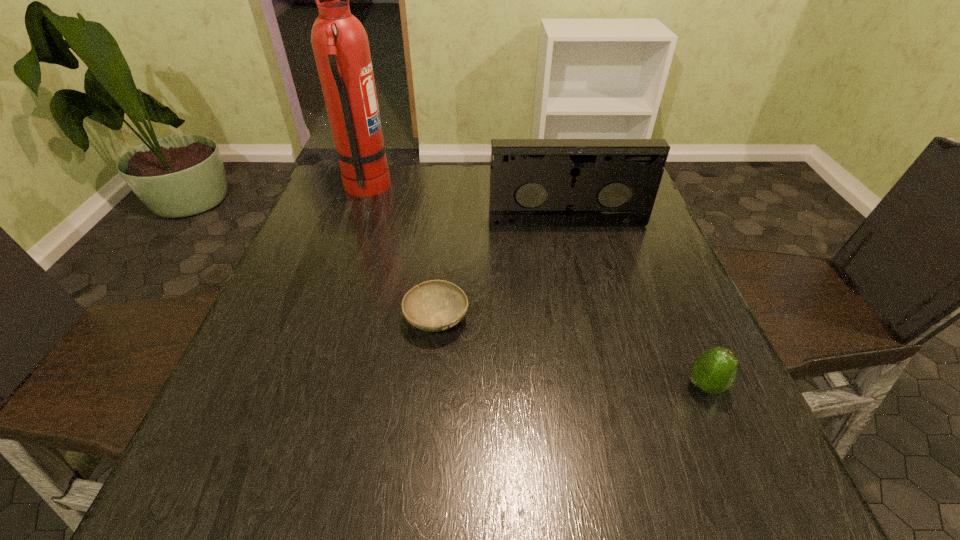
At what (x,y) coordinates should I click in order to perform the action: click on free region located on the left of the third tallest object. Please return your answer as a coordinate pair (x, y). Image resolution: width=960 pixels, height=540 pixels. Looking at the image, I should click on (510, 386).

At what (x,y) coordinates should I click in order to perform the action: click on vacant region located 0.260m on the left of the bowl. Please return your answer as a coordinate pair (x, y). Looking at the image, I should click on (276, 319).

Identify the location of object at the far edge. (340, 44).

Locate an element on the screen. The image size is (960, 540). object that is at the left edge is located at coordinates (340, 44).

The height and width of the screenshot is (540, 960). I want to click on videotape situated at the right edge, so click(533, 182).

Locate an element on the screen. This screenshot has width=960, height=540. avocado at the right edge is located at coordinates (714, 371).

Locate an element on the screen. object situated at the far left corner is located at coordinates pyautogui.click(x=340, y=44).

The width and height of the screenshot is (960, 540). In order to click on vacant area at the far edge in this screenshot , I will do `click(397, 170)`.

The height and width of the screenshot is (540, 960). Find the location of `free space at the near edge of the desktop`. free space at the near edge of the desktop is located at coordinates (366, 465).

I want to click on vacant space at the left edge of the desktop, so click(x=212, y=424).